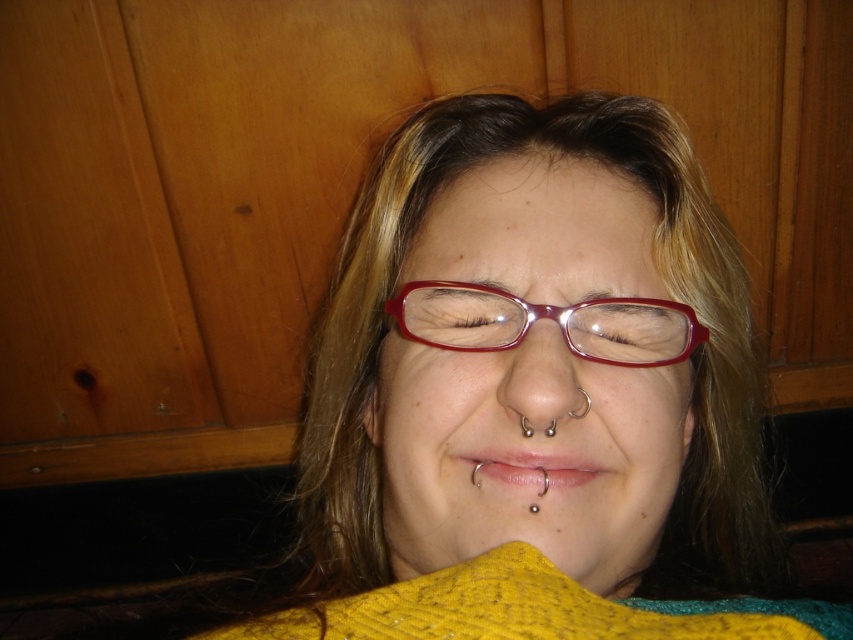
You are a tailor measuring a person for a custom sweater. You need to ensure the sweater doesn not interfere with the lip piercing. Given the distance between the matte yellow sweater at center and the silver metallic lip piercing at center, can the sweater be worn without touching the piercing?

The distance between the matte yellow sweater at center and the silver metallic lip piercing at center is 12.92 centimeters, so the sweater can be worn without touching the piercing as there is sufficient space between them.

You are a fashion designer who wants to create a new accessory that complements the matte yellow sweater at center. Considering the silver metallic lip piercing at center, which is smaller in size compared to the sweater, what material would you choose for the accessory to ensure it contrasts well with the sweater?

Since the matte yellow sweater at center is wider than the silver metallic lip piercing at center, the accessory should be made of a shiny material like metal to contrast with the matte texture of the sweater.

You are a fashion designer observing the image. You need to decide if the silver metallic lip piercing at center will be visible when the matte yellow sweater at center is worn. Based on their positions and sizes, what do you think?

The matte yellow sweater at center is taller than the silver metallic lip piercing at center, so the sweater may cover part of the piercing, making it less visible or not visible at all.